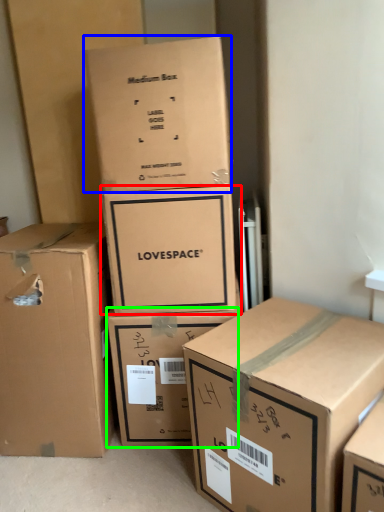
Question: Considering the real-world distances, which object is closest to box (highlighted by a red box)? box (highlighted by a blue box) or box (highlighted by a green box).

Choices:
 (A) box
 (B) box

Answer: (A)